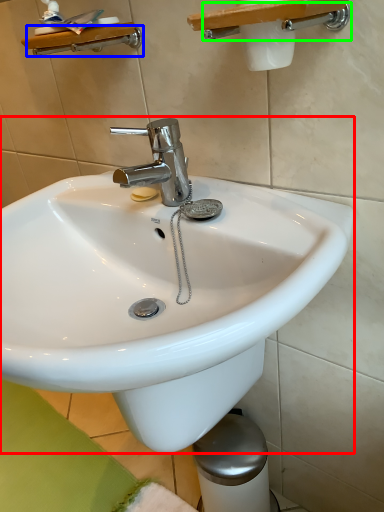
Question: Which is nearer to the sink (highlighted by a red box)? shower (highlighted by a blue box) or shower (highlighted by a green box).

Choices:
 (A) shower
 (B) shower

Answer: (B)